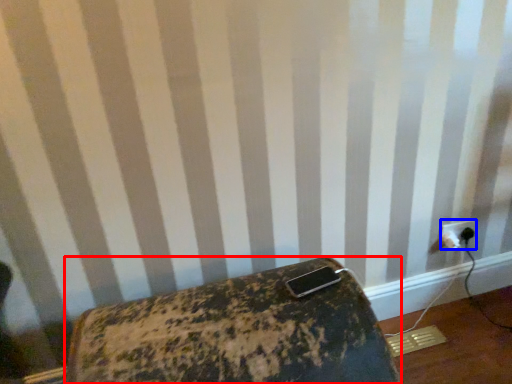
Question: Which object is further to the camera taking this photo, furniture (highlighted by a red box) or power plugs and sockets (highlighted by a blue box)?

Choices:
 (A) furniture
 (B) power plugs and sockets

Answer: (B)